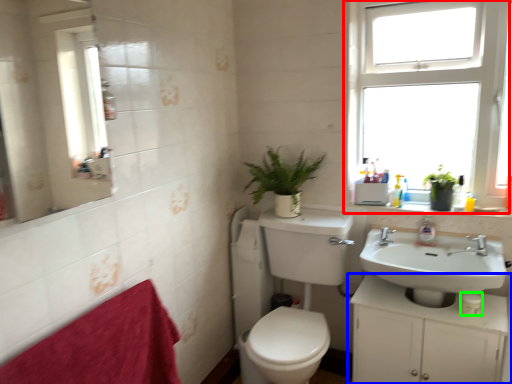
Question: Considering the real-world distances, which object is farthest from window (highlighted by a red box)? bathroom cabinet (highlighted by a blue box) or toilet paper (highlighted by a green box)?

Choices:
 (A) bathroom cabinet
 (B) toilet paper

Answer: (B)